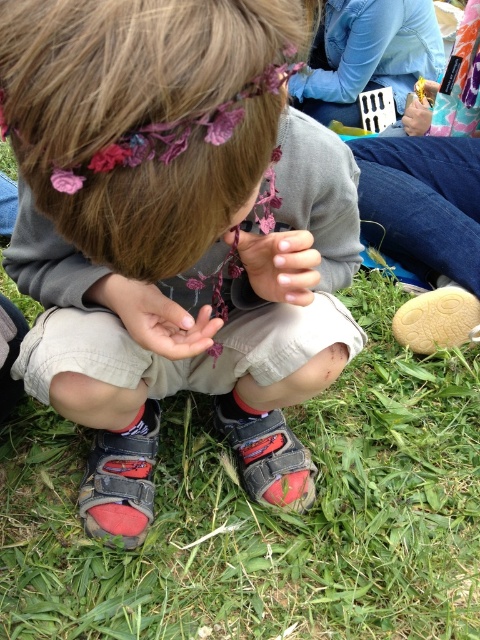
Between point (408, 324) and point (430, 342), which one is positioned behind?

The point (408, 324) is more distant.

In the scene shown: Can you confirm if leather sandal at lower right is taller than tan suede sandal at lower right?

Indeed, leather sandal at lower right has a greater height compared to tan suede sandal at lower right.

Identify the location of leather sandal at lower right. The image size is (480, 640). pos(425,228).

Is point (330, 620) positioned after point (311, 250)?

Yes.

What do you see at coordinates (266, 515) in the screenshot?
I see `green grass at lower center` at bounding box center [266, 515].

Which is in front, point (115, 570) or point (310, 296)?

Point (310, 296) is in front.

The width and height of the screenshot is (480, 640). Find the location of `green grass at lower center`. green grass at lower center is located at coordinates (266, 515).

Where is `red rubber sandal at lower left`? This screenshot has height=640, width=480. red rubber sandal at lower left is located at coordinates (120, 481).

Is point (126, 525) closer to viewer compared to point (128, 308)?

No, it is not.

Between point (101, 500) and point (145, 326), which one is positioned in front?

Point (145, 326)

In order to click on red rubber sandal at lower left in this screenshot , I will do `click(120, 481)`.